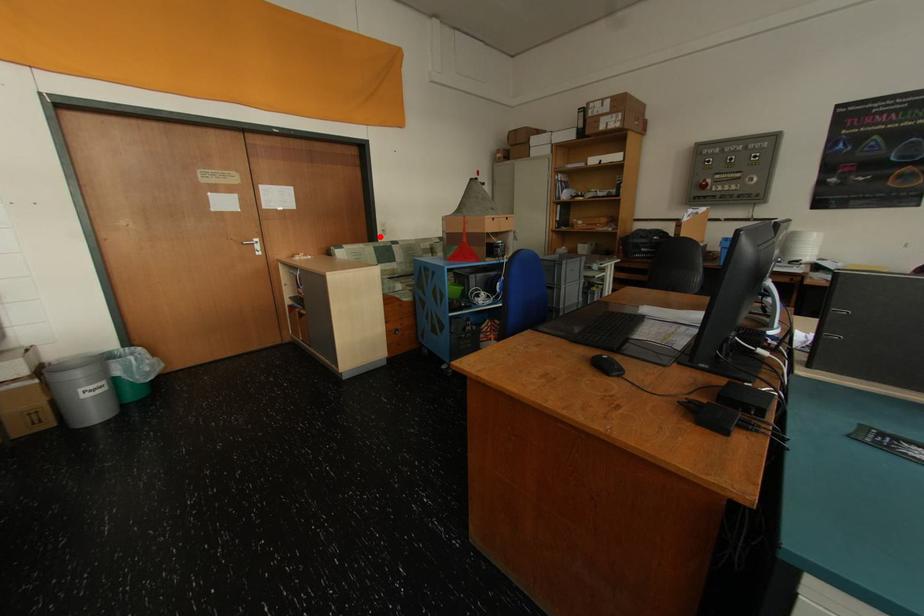
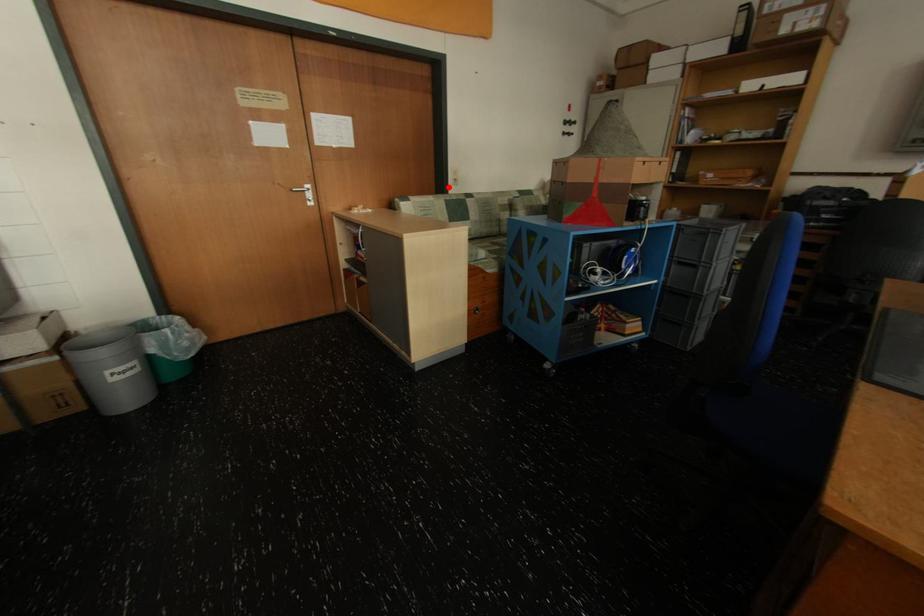
I am providing you with two images of the same scene from different viewpoints. A red point is marked on the first image and another point is marked on the second image. Is the marked point in image1 the same physical position as the marked point in image2?

Yes